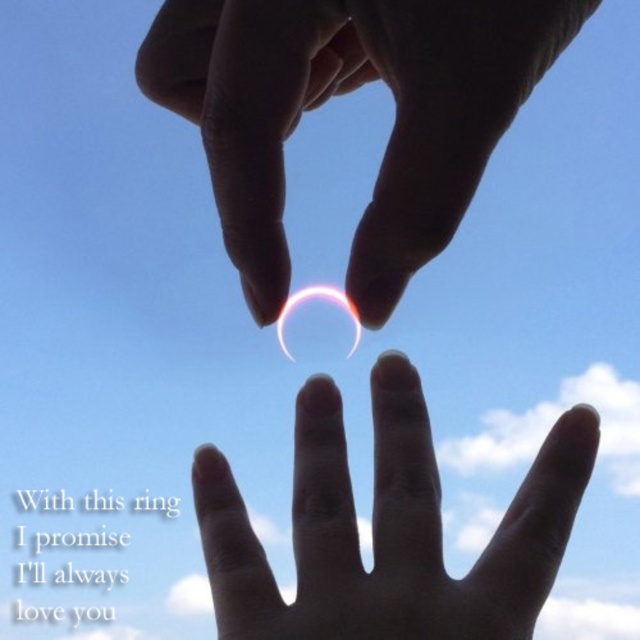
Can you confirm if silvery metallic ring at center is positioned to the right of translucent glass heart at center?

Correct, you'll find silvery metallic ring at center to the right of translucent glass heart at center.

Can you confirm if silvery metallic ring at center is wider than translucent glass heart at center?

Correct, the width of silvery metallic ring at center exceeds that of translucent glass heart at center.

The width and height of the screenshot is (640, 640). I want to click on silvery metallic ring at center, so click(342, 93).

Does silvery metallic ring at center appear on the right side of smooth skin hand at center?

No, silvery metallic ring at center is not to the right of smooth skin hand at center.

Is silvery metallic ring at center thinner than smooth skin hand at center?

Yes.

Is point (300, 45) more distant than point (310, 624)?

No, (300, 45) is in front of (310, 624).

Where is `silvery metallic ring at center`? silvery metallic ring at center is located at coordinates (342, 93).

Between smooth skin hand at center and translucent glass heart at center, which one appears on the left side from the viewer's perspective?

translucent glass heart at center

Does smooth skin hand at center appear over translucent glass heart at center?

Incorrect, smooth skin hand at center is not positioned above translucent glass heart at center.

The image size is (640, 640). Find the location of `smooth skin hand at center`. smooth skin hand at center is located at coordinates (387, 529).

Find the location of a particular element. The width and height of the screenshot is (640, 640). smooth skin hand at center is located at coordinates (387, 529).